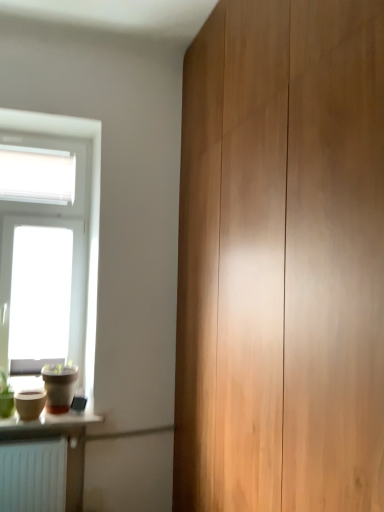
Question: Should I look upward or downward to see matte brown flowerpot at lower left?

Choices:
 (A) down
 (B) up

Answer: (A)